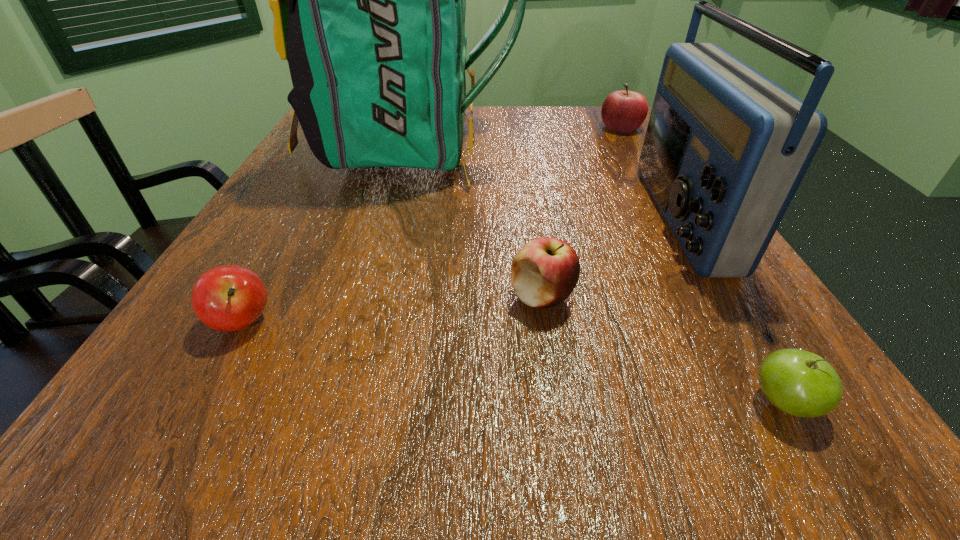
Where is `free point located on the back of the farthest apple`? free point located on the back of the farthest apple is located at coordinates (608, 106).

The height and width of the screenshot is (540, 960). Identify the location of free location located on the left of the second apple from left to right. (277, 296).

Where is `free space located 0.250m on the right of the leftmost apple`? The width and height of the screenshot is (960, 540). free space located 0.250m on the right of the leftmost apple is located at coordinates click(461, 321).

Identify the location of vacant point located 0.090m on the back of the nearest apple. Image resolution: width=960 pixels, height=540 pixels. (733, 320).

This screenshot has height=540, width=960. What are the coordinates of `backpack that is at the far edge` in the screenshot? It's located at (369, 0).

At what (x,y) coordinates should I click in order to perform the action: click on apple located in the far edge section of the desktop. Please return your answer as a coordinate pair (x, y). This screenshot has height=540, width=960. Looking at the image, I should click on (624, 111).

Find the location of a particular element. Image resolution: width=960 pixels, height=540 pixels. object at the near edge is located at coordinates (800, 383).

Locate an element on the screen. The height and width of the screenshot is (540, 960). backpack located in the left edge section of the desktop is located at coordinates (369, 0).

Locate an element on the screen. This screenshot has width=960, height=540. apple situated at the left edge is located at coordinates (227, 298).

At what (x,y) coordinates should I click in order to perform the action: click on radio receiver that is at the right edge. Please return your answer as a coordinate pair (x, y). The height and width of the screenshot is (540, 960). Looking at the image, I should click on (726, 148).